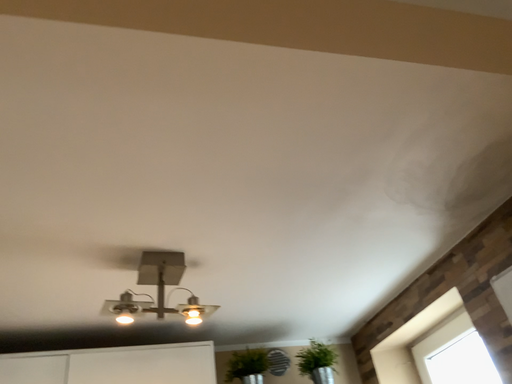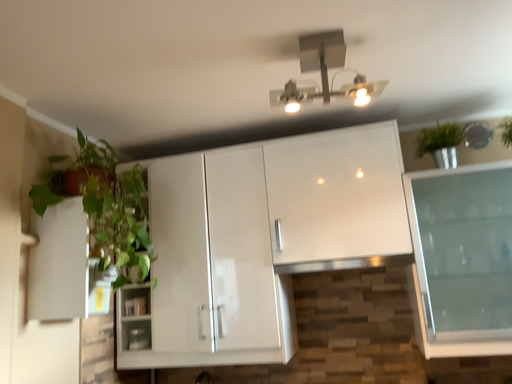
Question: Which way did the camera rotate in the video?

Choices:
 (A) rotated left
 (B) rotated right

Answer: (A)